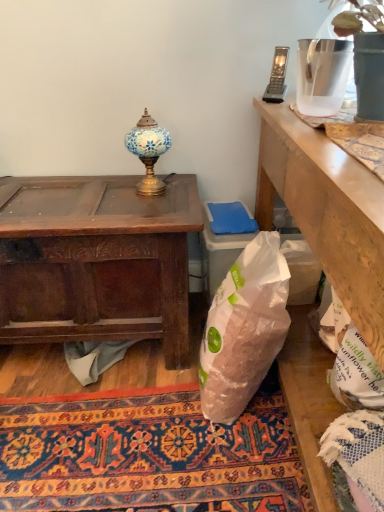
Identify the location of vacant area that lies to the right of gray fabric at lower center. The image size is (384, 512). (161, 373).